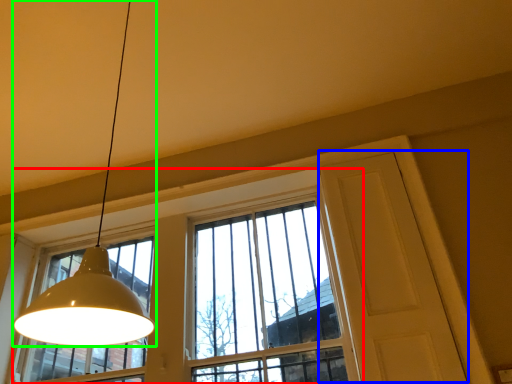
Question: Based on their relative distances, which object is nearer to window (highlighted by a red box)? Choose from screen door (highlighted by a blue box) and lamp (highlighted by a green box).

Choices:
 (A) screen door
 (B) lamp

Answer: (A)